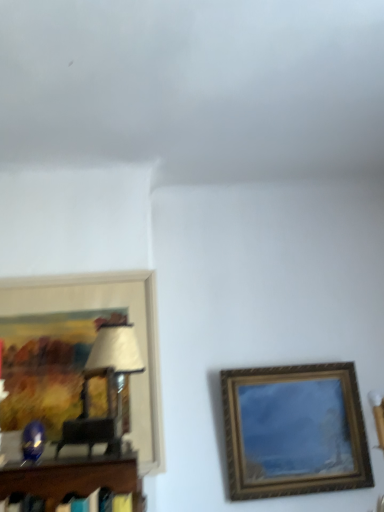
Question: Is gold-framed painting at right, the second picture frame from the left, in front of wooden framed artwork at left, positioned as the second picture frame in right-to-left order?

Choices:
 (A) yes
 (B) no

Answer: (B)

Question: Could you tell me if gold-framed painting at right, the second picture frame from the left, is turned towards wooden framed artwork at left, positioned as the second picture frame in right-to-left order?

Choices:
 (A) yes
 (B) no

Answer: (B)

Question: From a real-world perspective, is gold-framed painting at right, the second picture frame from the left, positioned over wooden framed artwork at left, positioned as the second picture frame in right-to-left order, based on gravity?

Choices:
 (A) no
 (B) yes

Answer: (A)

Question: Considering the relative sizes of gold-framed painting at right, the first picture frame viewed from the right, and wooden framed artwork at left, which is counted as the first picture frame, starting from the left, in the image provided, is gold-framed painting at right, the first picture frame viewed from the right, shorter than wooden framed artwork at left, which is counted as the first picture frame, starting from the left,?

Choices:
 (A) no
 (B) yes

Answer: (B)

Question: Is gold-framed painting at right, the second picture frame from the left, beside wooden framed artwork at left, positioned as the second picture frame in right-to-left order?

Choices:
 (A) yes
 (B) no

Answer: (B)

Question: Would you say gold-framed painting at right, the first picture frame viewed from the right, contains wooden framed artwork at left, positioned as the second picture frame in right-to-left order?

Choices:
 (A) no
 (B) yes

Answer: (A)

Question: From the image's perspective, is wooden framed artwork at left, positioned as the second picture frame in right-to-left order, above gold-framed painting at right, the first picture frame viewed from the right?

Choices:
 (A) no
 (B) yes

Answer: (B)

Question: Is gold-framed painting at right, the first picture frame viewed from the right, at the back of wooden framed artwork at left, which is counted as the first picture frame, starting from the left?

Choices:
 (A) no
 (B) yes

Answer: (A)

Question: Is wooden framed artwork at left, positioned as the second picture frame in right-to-left order, positioned behind gold-framed painting at right, the first picture frame viewed from the right?

Choices:
 (A) no
 (B) yes

Answer: (A)

Question: Could gold-framed painting at right, the second picture frame from the left, be considered to be inside wooden framed artwork at left, which is counted as the first picture frame, starting from the left?

Choices:
 (A) yes
 (B) no

Answer: (B)

Question: Is wooden framed artwork at left, positioned as the second picture frame in right-to-left order, outside of gold-framed painting at right, the second picture frame from the left?

Choices:
 (A) yes
 (B) no

Answer: (A)

Question: Relative to gold-framed painting at right, the second picture frame from the left, is wooden framed artwork at left, positioned as the second picture frame in right-to-left order, in front or behind?

Choices:
 (A) behind
 (B) front

Answer: (B)